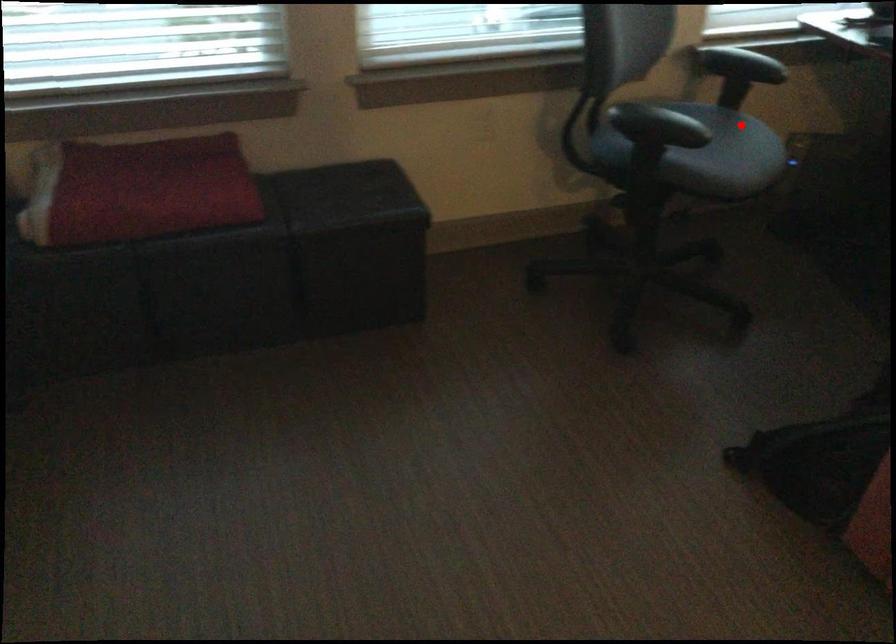
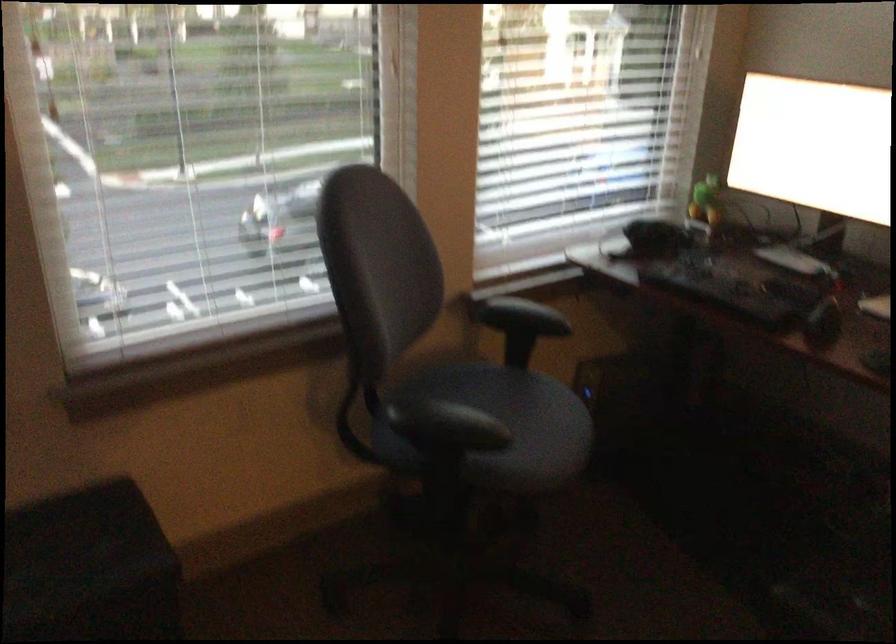
Question: I am providing you with two images of the same scene from different viewpoints. Image1 has a red point marked. In image2, the corresponding 3D location appears at what relative position? Reply with the corresponding letter.

Choices:
 (A) Closer
 (B) Farther

Answer: (A)